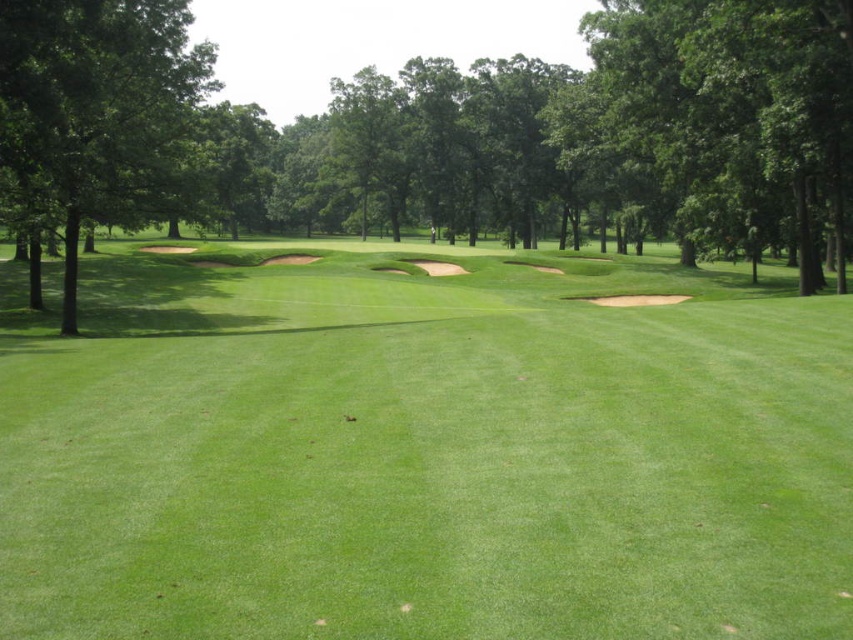
Question: Which of these objects is positioned closest to the green leafy tree at left?

Choices:
 (A) green leafy tree at center
 (B) green grassy fairway at center

Answer: (B)

Question: Which is farther from the green leafy tree at center?

Choices:
 (A) green grassy fairway at center
 (B) green leafy tree at left

Answer: (B)

Question: Which point is farther to the camera?

Choices:
 (A) green leafy tree at left
 (B) green leafy tree at center

Answer: (B)

Question: Can you confirm if green grassy fairway at center is smaller than green leafy tree at left?

Choices:
 (A) no
 (B) yes

Answer: (A)

Question: Is green grassy fairway at center bigger than green leafy tree at center?

Choices:
 (A) no
 (B) yes

Answer: (A)

Question: Is green grassy fairway at center thinner than green leafy tree at left?

Choices:
 (A) no
 (B) yes

Answer: (A)